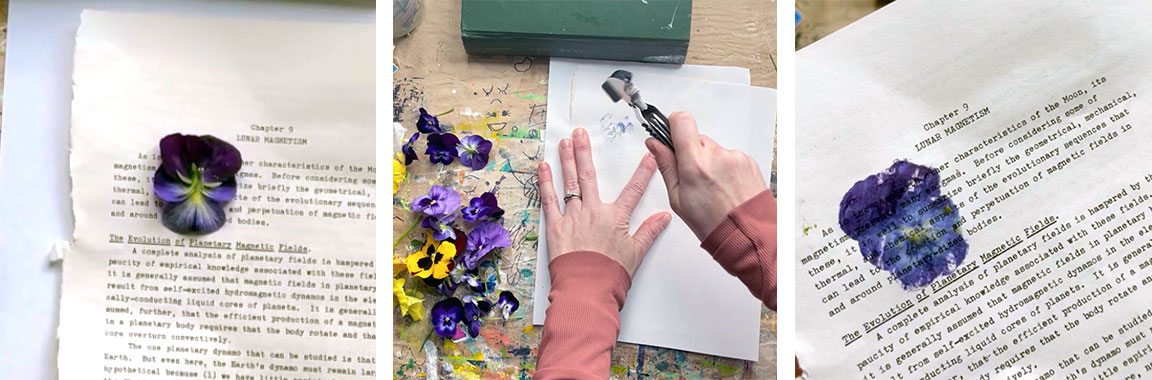
Where is `tabletop`? The image size is (1152, 380). tabletop is located at coordinates coord(450,89), coord(825,21), coord(7,19).